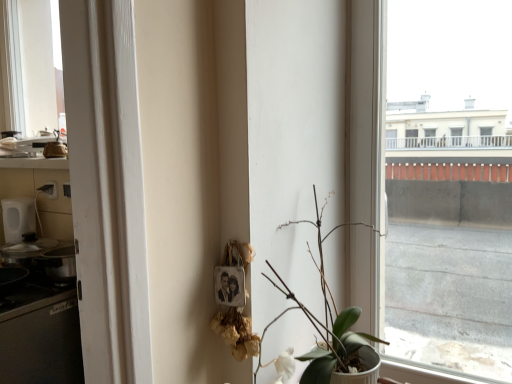
Question: Is transparent glass window at center placed right next to green matte plant at lower left?

Choices:
 (A) yes
 (B) no

Answer: (B)

Question: Does transparent glass window at center lie behind green matte plant at lower left?

Choices:
 (A) yes
 (B) no

Answer: (A)

Question: Is transparent glass window at center located outside green matte plant at lower left?

Choices:
 (A) yes
 (B) no

Answer: (A)

Question: Can you confirm if transparent glass window at center is shorter than green matte plant at lower left?

Choices:
 (A) no
 (B) yes

Answer: (A)

Question: Considering the relative sizes of transparent glass window at center and green matte plant at lower left in the image provided, is transparent glass window at center wider than green matte plant at lower left?

Choices:
 (A) no
 (B) yes

Answer: (A)

Question: From a real-world perspective, is transparent glass window at center physically below green matte plant at lower left?

Choices:
 (A) yes
 (B) no

Answer: (B)

Question: Can you confirm if green matte plant at lower left is smaller than transparent glass window at center?

Choices:
 (A) no
 (B) yes

Answer: (A)

Question: Is green matte plant at lower left wider than transparent glass window at center?

Choices:
 (A) no
 (B) yes

Answer: (B)

Question: Considering the relative positions of green matte plant at lower left and transparent glass window at center in the image provided, is green matte plant at lower left to the left of transparent glass window at center from the viewer's perspective?

Choices:
 (A) yes
 (B) no

Answer: (A)

Question: Is green matte plant at lower left not within transparent glass window at center?

Choices:
 (A) no
 (B) yes

Answer: (B)

Question: Is transparent glass window at center located within green matte plant at lower left?

Choices:
 (A) no
 (B) yes

Answer: (A)

Question: Does green matte plant at lower left come in front of transparent glass window at center?

Choices:
 (A) yes
 (B) no

Answer: (A)

Question: Based on their positions, is green matte plant at lower left located to the left or right of transparent glass window at center?

Choices:
 (A) left
 (B) right

Answer: (A)